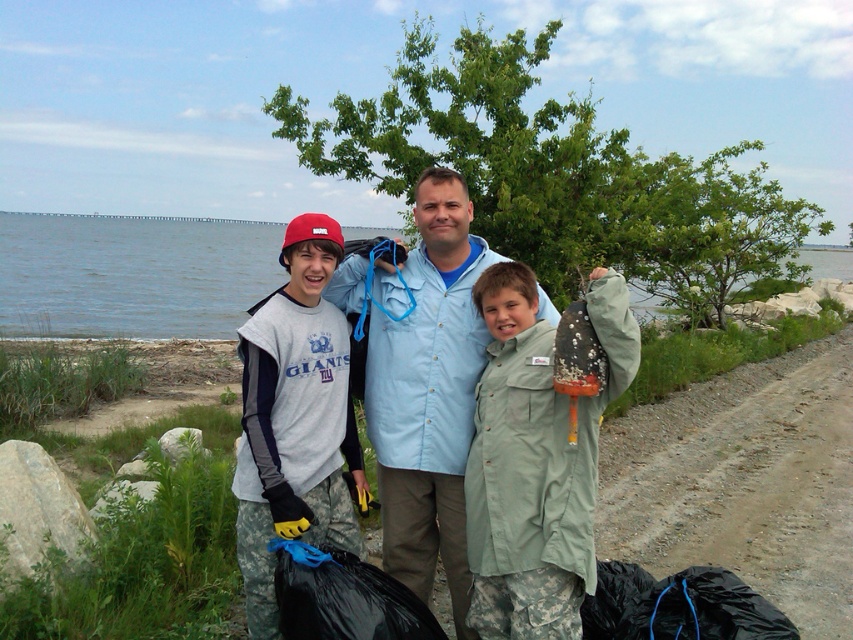
Question: Which of the following is the farthest from the observer?

Choices:
 (A) green matte jacket at center
 (B) blue water at center
 (C) light blue shirt at center

Answer: (B)

Question: Which of the following is the closest to the observer?

Choices:
 (A) click(431, 234)
 (B) click(534, 611)
 (C) click(107, 275)
 (D) click(312, 508)

Answer: (B)

Question: Which of the following is the closest to the observer?

Choices:
 (A) (241, 260)
 (B) (312, 228)
 (C) (607, 275)

Answer: (C)

Question: Does blue water at center have a lesser width compared to light blue shirt at center?

Choices:
 (A) no
 (B) yes

Answer: (A)

Question: Can you confirm if blue water at center is positioned above light blue shirt at center?

Choices:
 (A) no
 (B) yes

Answer: (B)

Question: Does blue water at center have a greater width compared to light blue shirt at center?

Choices:
 (A) yes
 (B) no

Answer: (A)